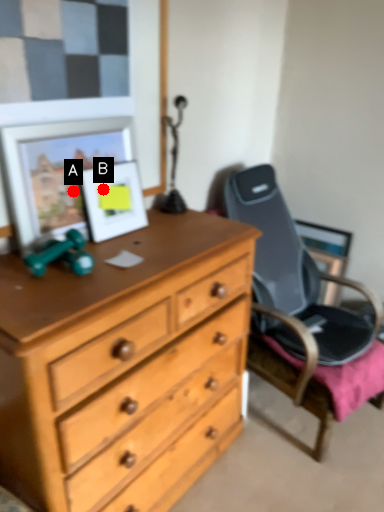
Question: Two points are circled on the image, labeled by A and B beside each circle. Which point is further to the camera?

Choices:
 (A) A is further
 (B) B is further

Answer: (B)